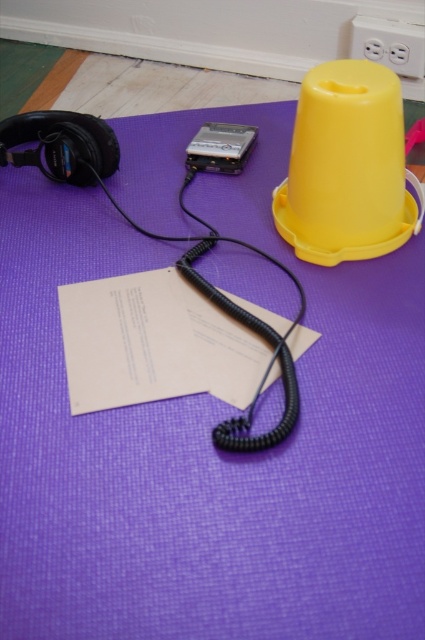
Question: Is yellow plastic cone at upper right behind matte black headphones at upper left?

Choices:
 (A) no
 (B) yes

Answer: (A)

Question: Can you confirm if matte black headphones at upper left is positioned above satin black ipod at center?

Choices:
 (A) no
 (B) yes

Answer: (A)

Question: Does yellow plastic cone at upper right appear on the right side of matte black headphones at upper left?

Choices:
 (A) no
 (B) yes

Answer: (B)

Question: Which point appears closest to the camera in this image?

Choices:
 (A) click(90, 340)
 (B) click(416, 35)
 (C) click(331, 236)

Answer: (A)

Question: Which point is closer to the camera?

Choices:
 (A) white paper at center
 (B) white plastic plug at upper right
 (C) yellow plastic cone at upper right

Answer: (A)

Question: Which of these objects is positioned closest to the white plastic plug at upper right?

Choices:
 (A) matte black headphones at upper left
 (B) yellow plastic cone at upper right

Answer: (B)